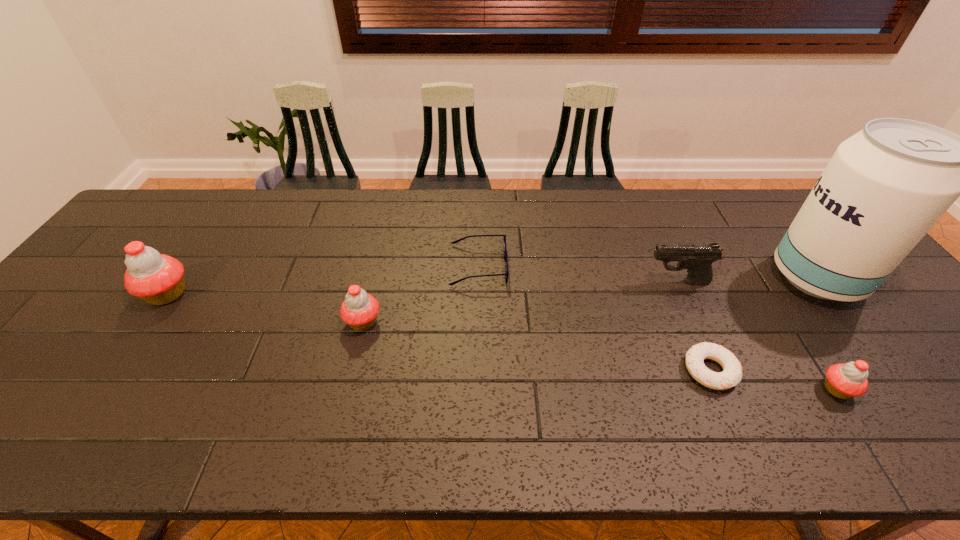
The width and height of the screenshot is (960, 540). Find the location of `the shortest object`. the shortest object is located at coordinates (731, 375).

At what (x,y) coordinates should I click in order to perform the action: click on vacant space located 0.220m on the back of the second tallest object. Please return your answer as a coordinate pair (x, y). Image resolution: width=960 pixels, height=540 pixels. Looking at the image, I should click on (213, 227).

Locate an element on the screen. The width and height of the screenshot is (960, 540). free space located 0.140m on the right of the second shortest cupcake is located at coordinates (438, 322).

Identify the location of free space located 0.320m on the back of the shortest cupcake. (763, 275).

The height and width of the screenshot is (540, 960). Find the location of `vacant space located 0.370m on the front-facing side of the second shortest object`. vacant space located 0.370m on the front-facing side of the second shortest object is located at coordinates (636, 266).

Where is `free spot located at the barrel of the pistol`? This screenshot has height=540, width=960. free spot located at the barrel of the pistol is located at coordinates (558, 282).

Locate an element on the screen. The width and height of the screenshot is (960, 540). vacant region located 0.260m at the barrel of the pistol is located at coordinates (550, 282).

The image size is (960, 540). I want to click on free space located at the barrel of the pistol, so click(x=612, y=282).

Locate an element on the screen. Image resolution: width=960 pixels, height=540 pixels. free spot located 0.200m on the left of the alcohol is located at coordinates (701, 278).

At what (x,y) coordinates should I click in order to perform the action: click on vacant space located 0.070m on the back of the doughnut. Please return your answer as a coordinate pair (x, y). Looking at the image, I should click on (691, 326).